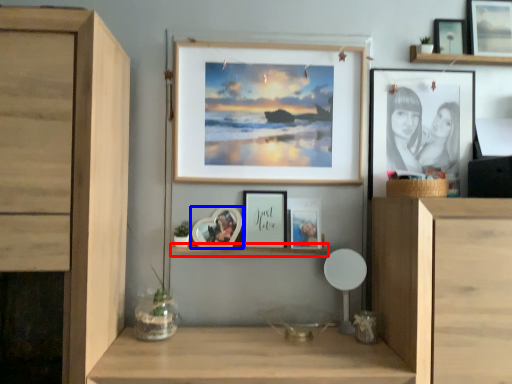
Question: Which point is closer to the camera, shelf (highlighted by a red box) or picture frame (highlighted by a blue box)?

Choices:
 (A) shelf
 (B) picture frame

Answer: (B)